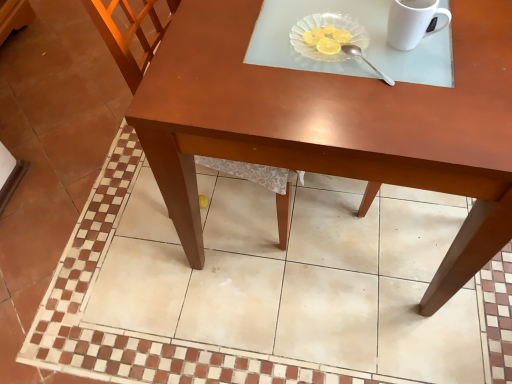
Identify the location of vacant area that is situated to the right of white glossy mug at upper right. The image size is (512, 384). (468, 37).